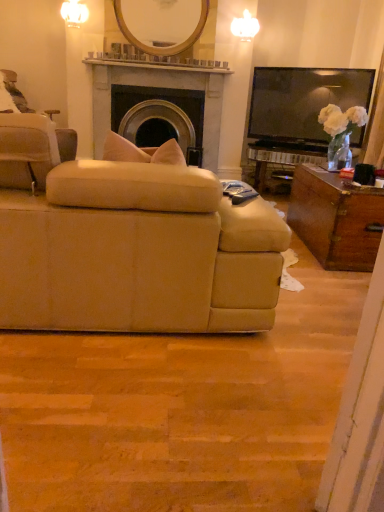
Question: Considering the relative positions of beige fabric chair at left and wooden/matte mirror at upper center in the image provided, is beige fabric chair at left to the left of wooden/matte mirror at upper center from the viewer's perspective?

Choices:
 (A) no
 (B) yes

Answer: (B)

Question: Considering the relative positions of beige fabric chair at left and wooden/matte mirror at upper center in the image provided, is beige fabric chair at left behind wooden/matte mirror at upper center?

Choices:
 (A) no
 (B) yes

Answer: (A)

Question: Is beige fabric chair at left positioned with its back to wooden/matte mirror at upper center?

Choices:
 (A) no
 (B) yes

Answer: (A)

Question: Is beige fabric chair at left directly adjacent to wooden/matte mirror at upper center?

Choices:
 (A) no
 (B) yes

Answer: (A)

Question: Is beige fabric chair at left positioned before wooden/matte mirror at upper center?

Choices:
 (A) no
 (B) yes

Answer: (B)

Question: Is black plastic remote control at center to the left or to the right of beige fabric couch at center in the image?

Choices:
 (A) right
 (B) left

Answer: (A)

Question: Is black plastic remote control at center bigger or smaller than beige fabric couch at center?

Choices:
 (A) small
 (B) big

Answer: (A)

Question: Is point (235, 198) closer or farther from the camera than point (261, 237)?

Choices:
 (A) farther
 (B) closer

Answer: (A)

Question: From the image's perspective, is black plastic remote control at center positioned above or below beige fabric couch at center?

Choices:
 (A) above
 (B) below

Answer: (A)

Question: Is point (208, 75) closer or farther from the camera than point (67, 152)?

Choices:
 (A) closer
 (B) farther

Answer: (B)

Question: In terms of height, does matte stone fireplace at center look taller or shorter compared to beige fabric chair at left?

Choices:
 (A) short
 (B) tall

Answer: (B)

Question: From the image's perspective, is matte stone fireplace at center above or below beige fabric chair at left?

Choices:
 (A) above
 (B) below

Answer: (A)

Question: Relative to beige fabric chair at left, is matte stone fireplace at center in front or behind?

Choices:
 (A) behind
 (B) front

Answer: (A)

Question: From a real-world perspective, is beige fabric chair at left physically located above or below matte stone fireplace at center?

Choices:
 (A) below
 (B) above

Answer: (B)

Question: Is beige fabric chair at left in front of or behind matte stone fireplace at center in the image?

Choices:
 (A) behind
 (B) front

Answer: (B)